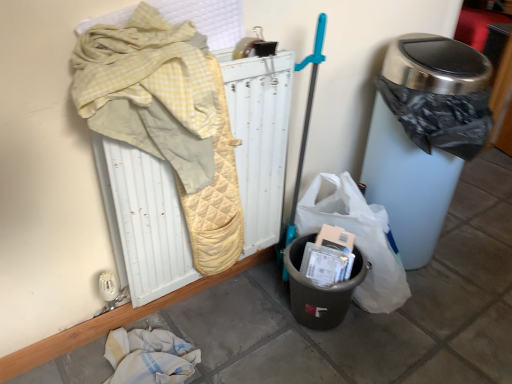
What do you see at coordinates (144, 221) in the screenshot? I see `yellow quilted radiator at upper left` at bounding box center [144, 221].

The width and height of the screenshot is (512, 384). What do you see at coordinates (418, 138) in the screenshot? I see `metallic trash can at right` at bounding box center [418, 138].

You are a GUI agent. You are given a task and a screenshot of the screen. Output one action in this format:
    pyautogui.click(x=<x>, y=<y>)
    Task: Click on the yellow quilted radiator at upper left
    This screenshot has height=384, width=512.
    Given the screenshot: What is the action you would take?
    pyautogui.click(x=144, y=221)

Which of these two, yellow quilted radiator at upper left or metallic trash can at right, stands taller?

metallic trash can at right is taller.

Does yellow quilted radiator at upper left come in front of metallic trash can at right?

Yes, yellow quilted radiator at upper left is closer to the camera.

From a real-world perspective, between yellow quilted radiator at upper left and metallic trash can at right, who is vertically lower?

metallic trash can at right, from a real-world perspective.

Considering the sizes of objects yellow quilted radiator at upper left and metallic trash can at right in the image provided, who is thinner, yellow quilted radiator at upper left or metallic trash can at right?

yellow quilted radiator at upper left.

Does point (416, 57) appear closer or farther from the camera than point (342, 319)?

Clearly, point (416, 57) is more distant from the camera than point (342, 319).

Considering the relative sizes of metallic trash can at right and black plastic recycling bin at lower center in the image provided, is metallic trash can at right taller than black plastic recycling bin at lower center?

Yes.

Is black plastic recycling bin at lower center far away from metallic trash can at right?

black plastic recycling bin at lower center is near metallic trash can at right, not far away.

Is black plastic recycling bin at lower center outside of metallic trash can at right?

Yes, black plastic recycling bin at lower center is outside of metallic trash can at right.

Looking at this image, considering the relative sizes of black plastic recycling bin at lower center and metallic trash can at right in the image provided, is black plastic recycling bin at lower center smaller than metallic trash can at right?

Yes, black plastic recycling bin at lower center is smaller than metallic trash can at right.

Considering the positions of point (338, 292) and point (459, 94), is point (338, 292) closer or farther from the camera than point (459, 94)?

Point (338, 292) is farther from the camera than point (459, 94).

Which of these two, black plastic recycling bin at lower center or yellow quilted radiator at upper left, is wider?

With larger width is black plastic recycling bin at lower center.

Is black plastic recycling bin at lower center to the left of yellow quilted radiator at upper left from the viewer's perspective?

No.

From a real-world perspective, is black plastic recycling bin at lower center on yellow quilted radiator at upper left?

No, from a real-world perspective, black plastic recycling bin at lower center is not over yellow quilted radiator at upper left

Is metallic trash can at right positioned beyond the bounds of yellow quilted radiator at upper left?

Yes, metallic trash can at right is located beyond the bounds of yellow quilted radiator at upper left.

In the scene shown: Which is more to the right, metallic trash can at right or yellow quilted radiator at upper left?

From the viewer's perspective, metallic trash can at right appears more on the right side.

Is point (397, 135) closer to viewer compared to point (134, 217)?

No, it is not.

Does yellow quilted radiator at upper left turn towards black plastic recycling bin at lower center?

Yes, yellow quilted radiator at upper left faces towards black plastic recycling bin at lower center.

Based on the photo, can you confirm if yellow quilted radiator at upper left is bigger than black plastic recycling bin at lower center?

Yes, yellow quilted radiator at upper left is bigger than black plastic recycling bin at lower center.

From the image's perspective, which one is positioned higher, yellow quilted radiator at upper left or black plastic recycling bin at lower center?

yellow quilted radiator at upper left is shown above in the image.

Can you confirm if yellow quilted radiator at upper left is shorter than black plastic recycling bin at lower center?

Incorrect, the height of yellow quilted radiator at upper left does not fall short of that of black plastic recycling bin at lower center.

In the image, there is a yellow quilted radiator at upper left. Find the location of `waste container above it (from the image's perspective)`. waste container above it (from the image's perspective) is located at coordinates (418, 138).

Image resolution: width=512 pixels, height=384 pixels. I want to click on waste container lying in front of the black plastic recycling bin at lower center, so click(418, 138).

Considering their positions, is yellow quilted radiator at upper left positioned closer to black plastic recycling bin at lower center than metallic trash can at right?

Based on the image, yellow quilted radiator at upper left appears to be nearer to black plastic recycling bin at lower center.

When comparing their distances from metallic trash can at right, does yellow quilted radiator at upper left or black plastic recycling bin at lower center seem further?

Based on the image, yellow quilted radiator at upper left appears to be further to metallic trash can at right.

Which object lies nearer to the anchor point metallic trash can at right, black plastic recycling bin at lower center or yellow quilted radiator at upper left?

black plastic recycling bin at lower center is positioned closer to the anchor metallic trash can at right.

In the scene shown: From the image, which object appears to be farther from yellow quilted radiator at upper left, metallic trash can at right or black plastic recycling bin at lower center?

The object further to yellow quilted radiator at upper left is metallic trash can at right.

When comparing their distances from black plastic recycling bin at lower center, does metallic trash can at right or yellow quilted radiator at upper left seem further?

metallic trash can at right is further to black plastic recycling bin at lower center.

Looking at the image, which one is located further to yellow quilted radiator at upper left, black plastic recycling bin at lower center or metallic trash can at right?

metallic trash can at right is positioned further to the anchor yellow quilted radiator at upper left.

Locate an element on the screen. recycling bin located between yellow quilted radiator at upper left and metallic trash can at right in the left-right direction is located at coordinates pyautogui.click(x=320, y=289).